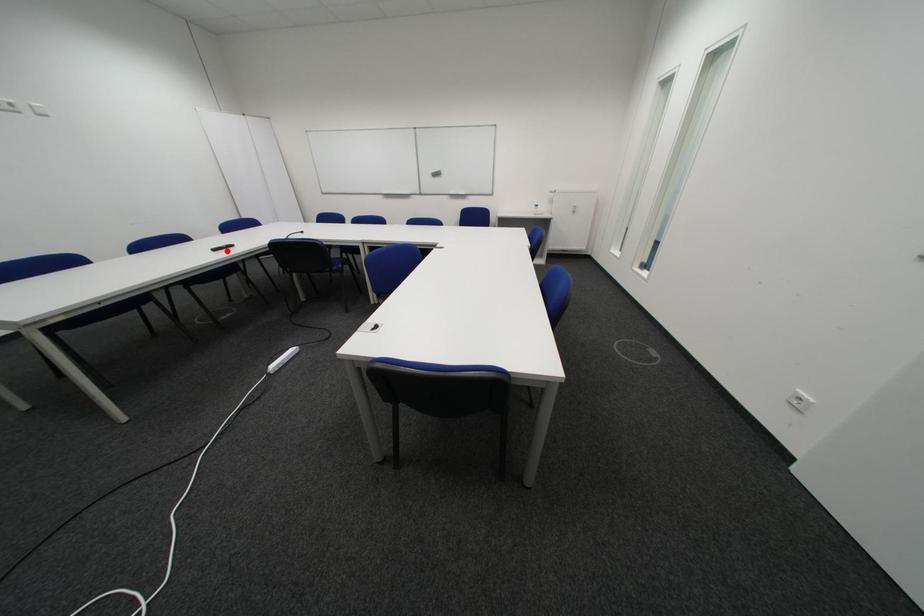
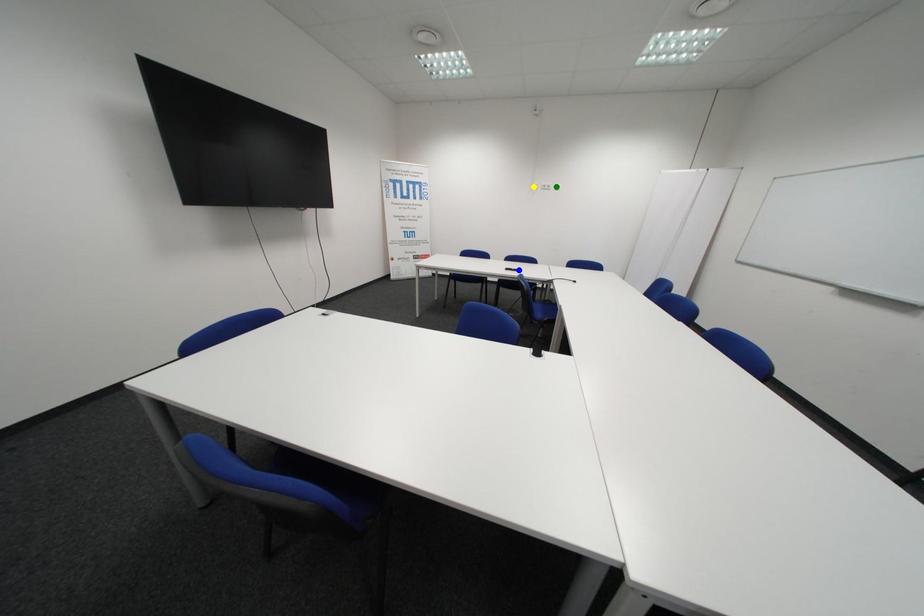
Question: I am providing you with two images of the same scene from different viewpoints. A red point is marked on the first image. You are given multiple points on the second image. Can you choose the point in image 2 that corresponds to the point in image 1?

Choices:
 (A) green point
 (B) yellow point
 (C) blue point

Answer: (C)